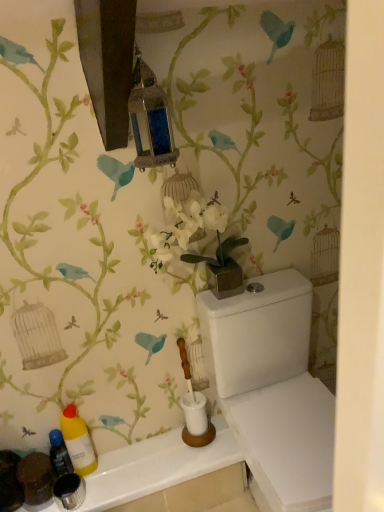
From the picture: What is the approximate height of white glossy porcelain at lower right?

white glossy porcelain at lower right is 31.98 inches tall.

Describe the element at coordinates (168, 474) in the screenshot. This screenshot has height=512, width=384. I see `white glossy counter top at lower left` at that location.

Locate an element on the screen. white glossy counter top at lower left is located at coordinates (168, 474).

The width and height of the screenshot is (384, 512). What are the coordinates of `yellow matte bottle at lower left, which is counted as the second bottle, starting from the left` in the screenshot? It's located at (78, 441).

Describe the element at coordinates (78, 441) in the screenshot. I see `yellow matte bottle at lower left, placed as the first bottle when sorted from right to left` at that location.

Locate an element on the screen. This screenshot has height=512, width=384. translucent plastic bottle at lower left, the 2th bottle when ordered from right to left is located at coordinates (59, 454).

Considering the sizes of objects white glossy porcelain at lower right and translucent plastic bottle at lower left, the 2th bottle when ordered from right to left, in the image provided, who is thinner, white glossy porcelain at lower right or translucent plastic bottle at lower left, the 2th bottle when ordered from right to left,?

Thinner between the two is translucent plastic bottle at lower left, the 2th bottle when ordered from right to left.

Is white glossy porcelain at lower right at the left side of translucent plastic bottle at lower left, the first bottle viewed from the left?

No.

Considering the points (293, 390) and (60, 466), which point is in front, point (293, 390) or point (60, 466)?

The point (293, 390) is closer to the camera.

From a real-world perspective, which object stands above the other?

white glossy porcelain at lower right, from a real-world perspective.

From the image's perspective, does white glossy counter top at lower left appear lower than white glossy porcelain at lower right?

Yes, from the image's perspective, white glossy counter top at lower left is below white glossy porcelain at lower right.

Considering the relative sizes of white glossy counter top at lower left and white glossy porcelain at lower right in the image provided, is white glossy counter top at lower left thinner than white glossy porcelain at lower right?

Indeed, white glossy counter top at lower left has a lesser width compared to white glossy porcelain at lower right.

Between white glossy counter top at lower left and white glossy porcelain at lower right, which one appears on the right side from the viewer's perspective?

white glossy porcelain at lower right is more to the right.

Is the position of white glossy counter top at lower left more distant than that of white glossy porcelain at lower right?

Yes, white glossy counter top at lower left is behind white glossy porcelain at lower right.

Is translucent plastic bottle at lower left, the first bottle viewed from the left, taller than white glossy counter top at lower left?

Indeed, translucent plastic bottle at lower left, the first bottle viewed from the left, has a greater height compared to white glossy counter top at lower left.

Is translucent plastic bottle at lower left, the 2th bottle when ordered from right to left, spatially inside white glossy counter top at lower left, or outside of it?

translucent plastic bottle at lower left, the 2th bottle when ordered from right to left, is not enclosed by white glossy counter top at lower left.

Identify the location of counter top lying in front of the translucent plastic bottle at lower left, the first bottle viewed from the left. (168, 474).

Is white glossy counter top at lower left not near yellow matte bottle at lower left, which is counted as the second bottle, starting from the left?

No, white glossy counter top at lower left is not far from yellow matte bottle at lower left, which is counted as the second bottle, starting from the left.

Looking at this image, who is taller, white glossy counter top at lower left or yellow matte bottle at lower left, placed as the first bottle when sorted from right to left?

Standing taller between the two is yellow matte bottle at lower left, placed as the first bottle when sorted from right to left.

From the picture: From the image's perspective, is white glossy counter top at lower left positioned above or below yellow matte bottle at lower left, which is counted as the second bottle, starting from the left?

From the image's perspective, white glossy counter top at lower left appears below yellow matte bottle at lower left, which is counted as the second bottle, starting from the left.

Is yellow matte bottle at lower left, placed as the first bottle when sorted from right to left, located within white glossy counter top at lower left?

That's incorrect, yellow matte bottle at lower left, placed as the first bottle when sorted from right to left, is not inside white glossy counter top at lower left.

Between yellow matte bottle at lower left, which is counted as the second bottle, starting from the left, and translucent plastic bottle at lower left, the first bottle viewed from the left, which one has smaller size?

With smaller size is translucent plastic bottle at lower left, the first bottle viewed from the left.

Which object is wider, yellow matte bottle at lower left, placed as the first bottle when sorted from right to left, or translucent plastic bottle at lower left, the first bottle viewed from the left?

With larger width is yellow matte bottle at lower left, placed as the first bottle when sorted from right to left.

In the scene shown: Is yellow matte bottle at lower left, placed as the first bottle when sorted from right to left, taller than translucent plastic bottle at lower left, the first bottle viewed from the left?

Correct, yellow matte bottle at lower left, placed as the first bottle when sorted from right to left, is much taller as translucent plastic bottle at lower left, the first bottle viewed from the left.

Could you measure the distance between translucent plastic bottle at lower left, the first bottle viewed from the left, and yellow matte bottle at lower left, which is counted as the second bottle, starting from the left?

2.19 inches.

Is translucent plastic bottle at lower left, the 2th bottle when ordered from right to left, in front of or behind yellow matte bottle at lower left, which is counted as the second bottle, starting from the left, in the image?

Clearly, translucent plastic bottle at lower left, the 2th bottle when ordered from right to left, is behind yellow matte bottle at lower left, which is counted as the second bottle, starting from the left.

Does translucent plastic bottle at lower left, the first bottle viewed from the left, touch yellow matte bottle at lower left, placed as the first bottle when sorted from right to left?

Yes, translucent plastic bottle at lower left, the first bottle viewed from the left, is beside yellow matte bottle at lower left, placed as the first bottle when sorted from right to left.

In the scene shown: Based on their sizes in the image, would you say translucent plastic bottle at lower left, the 2th bottle when ordered from right to left, is bigger or smaller than yellow matte bottle at lower left, placed as the first bottle when sorted from right to left?

In the image, translucent plastic bottle at lower left, the 2th bottle when ordered from right to left, appears to be smaller than yellow matte bottle at lower left, placed as the first bottle when sorted from right to left.

Which is correct: translucent plastic bottle at lower left, the first bottle viewed from the left, is inside white glossy porcelain at lower right, or outside of it?

translucent plastic bottle at lower left, the first bottle viewed from the left, lies outside white glossy porcelain at lower right.

Considering the relative sizes of translucent plastic bottle at lower left, the first bottle viewed from the left, and white glossy porcelain at lower right in the image provided, is translucent plastic bottle at lower left, the first bottle viewed from the left, taller than white glossy porcelain at lower right?

In fact, translucent plastic bottle at lower left, the first bottle viewed from the left, may be shorter than white glossy porcelain at lower right.

Is translucent plastic bottle at lower left, the 2th bottle when ordered from right to left, beside white glossy porcelain at lower right?

No, translucent plastic bottle at lower left, the 2th bottle when ordered from right to left, is not making contact with white glossy porcelain at lower right.

What's the angular difference between translucent plastic bottle at lower left, the 2th bottle when ordered from right to left, and white glossy porcelain at lower right's facing directions?

The angle between the facing direction of translucent plastic bottle at lower left, the 2th bottle when ordered from right to left, and the facing direction of white glossy porcelain at lower right is 0.000115 degrees.

This screenshot has width=384, height=512. I want to click on porcelain in front of the translucent plastic bottle at lower left, the 2th bottle when ordered from right to left, so click(272, 387).

The width and height of the screenshot is (384, 512). What are the coordinates of `counter top that appears on the left of white glossy porcelain at lower right` in the screenshot? It's located at (168, 474).

Consider the image. From the image, which object appears to be farther from white glossy porcelain at lower right, white glossy counter top at lower left or yellow matte bottle at lower left, which is counted as the second bottle, starting from the left?

Based on the image, yellow matte bottle at lower left, which is counted as the second bottle, starting from the left, appears to be further to white glossy porcelain at lower right.

Looking at the image, which one is located closer to white glossy counter top at lower left, translucent plastic bottle at lower left, the 2th bottle when ordered from right to left, or white glossy porcelain at lower right?

The object closer to white glossy counter top at lower left is translucent plastic bottle at lower left, the 2th bottle when ordered from right to left.

Considering their positions, is white glossy counter top at lower left positioned closer to yellow matte bottle at lower left, which is counted as the second bottle, starting from the left, than translucent plastic bottle at lower left, the 2th bottle when ordered from right to left?

Among the two, translucent plastic bottle at lower left, the 2th bottle when ordered from right to left, is located nearer to yellow matte bottle at lower left, which is counted as the second bottle, starting from the left.

Looking at the image, which one is located closer to white glossy counter top at lower left, translucent plastic bottle at lower left, the 2th bottle when ordered from right to left, or yellow matte bottle at lower left, which is counted as the second bottle, starting from the left?

Based on the image, yellow matte bottle at lower left, which is counted as the second bottle, starting from the left, appears to be nearer to white glossy counter top at lower left.

Looking at the image, which one is located further to yellow matte bottle at lower left, placed as the first bottle when sorted from right to left, white glossy porcelain at lower right or translucent plastic bottle at lower left, the 2th bottle when ordered from right to left?

Among the two, white glossy porcelain at lower right is located further to yellow matte bottle at lower left, placed as the first bottle when sorted from right to left.

Considering their positions, is white glossy counter top at lower left positioned further to yellow matte bottle at lower left, which is counted as the second bottle, starting from the left, than white glossy porcelain at lower right?

white glossy porcelain at lower right is positioned further to the anchor yellow matte bottle at lower left, which is counted as the second bottle, starting from the left.

Based on their spatial positions, is translucent plastic bottle at lower left, the first bottle viewed from the left, or white glossy porcelain at lower right further from yellow matte bottle at lower left, placed as the first bottle when sorted from right to left?

white glossy porcelain at lower right is further to yellow matte bottle at lower left, placed as the first bottle when sorted from right to left.

When comparing their distances from translucent plastic bottle at lower left, the first bottle viewed from the left, does white glossy porcelain at lower right or yellow matte bottle at lower left, placed as the first bottle when sorted from right to left, seem further?

Among the two, white glossy porcelain at lower right is located further to translucent plastic bottle at lower left, the first bottle viewed from the left.

Locate an element on the screen. counter top between translucent plastic bottle at lower left, the 2th bottle when ordered from right to left, and white glossy porcelain at lower right, in the horizontal direction is located at coordinates (168, 474).

Image resolution: width=384 pixels, height=512 pixels. I want to click on counter top between yellow matte bottle at lower left, placed as the first bottle when sorted from right to left, and white glossy porcelain at lower right, in the horizontal direction, so click(168, 474).

I want to click on bottle between translucent plastic bottle at lower left, the 2th bottle when ordered from right to left, and white glossy porcelain at lower right, so click(78, 441).

Find the location of `bottle located between translucent plastic bottle at lower left, the 2th bottle when ordered from right to left, and white glossy counter top at lower left in the left-right direction`. bottle located between translucent plastic bottle at lower left, the 2th bottle when ordered from right to left, and white glossy counter top at lower left in the left-right direction is located at coordinates (78, 441).